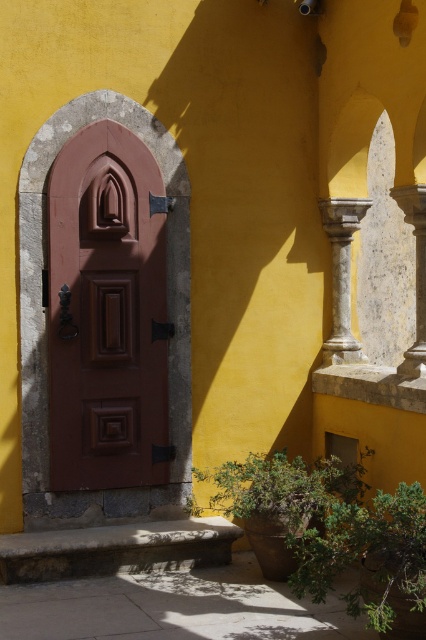
Does point (344, 228) lie behind point (403, 365)?

Yes, it is.

Is white marble column at center in front of smooth stone column at right?

No, white marble column at center is further to the viewer.

Is point (339, 262) closer to camera compared to point (419, 314)?

That is False.

The width and height of the screenshot is (426, 640). I want to click on white marble column at center, so click(342, 275).

Which is below, matte wood door at center or smooth stone column at right?

matte wood door at center is lower down.

The height and width of the screenshot is (640, 426). What are the coordinates of `matte wood door at center` in the screenshot? It's located at (106, 314).

Who is more distant from viewer, (83, 166) or (423, 253)?

The point (83, 166) is more distant.

Where is `matte wood door at center`? This screenshot has height=640, width=426. matte wood door at center is located at coordinates (106, 314).

Which of these two, matte wood door at center or white marble column at center, stands taller?

With more height is matte wood door at center.

Is matte wood door at center smaller than white marble column at center?

Actually, matte wood door at center might be larger than white marble column at center.

Measure the distance between point [66,161] and camera.

Point [66,161] is 20.14 feet from camera.

The image size is (426, 640). What are the coordinates of `matte wood door at center` in the screenshot? It's located at (x=106, y=314).